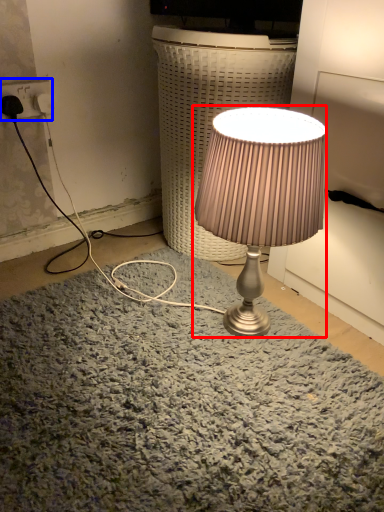
Question: Which object appears closest to the camera in this image, lamp (highlighted by a red box) or electric outlet (highlighted by a blue box)?

Choices:
 (A) lamp
 (B) electric outlet

Answer: (A)